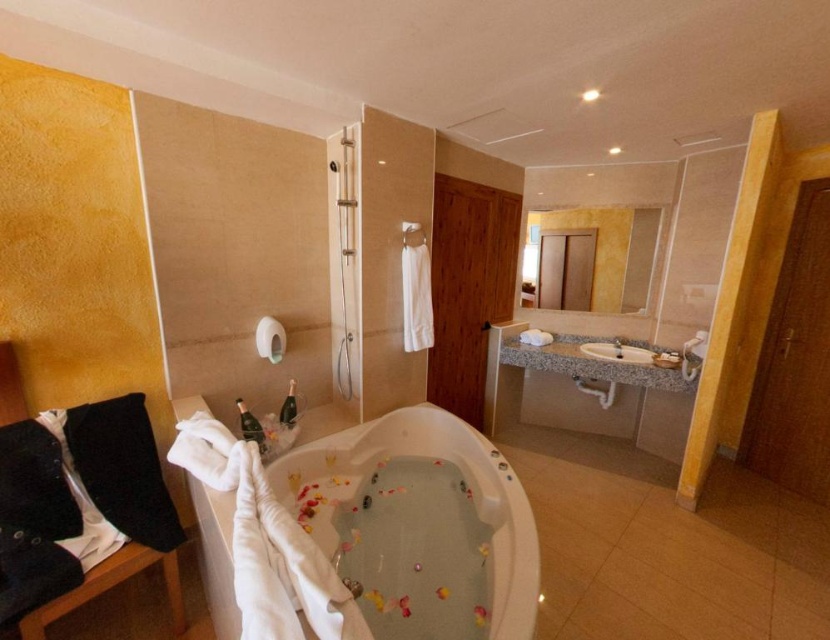
You are planning to bring a large gift box that is 1.2 meters wide into the bathroom. You want to place it next to the white glossy bathtub at center and the white marble sink at center. Which object should you place it next to if the gift box is wider than both?

The white glossy bathtub at center has a larger width than the white marble sink at center, so you should place the gift box next to the white glossy bathtub at center since it can accommodate the wider gift box.

You are designing a bathroom layout and need to ensure that the white glossy bathtub at center and the white marble sink at center are accessible to someone of average height. Based on their heights, which one would require the user to bend down more when using it?

The white marble sink at center requires the user to bend down more because it has a lower height compared to the white glossy bathtub at center.

You are standing at the entrance of the bathroom and want to fill the white glossy bathtub at center with water. Which direction should you move towards to reach the bathtub?

Since the white glossy bathtub at center is located at point 0.833 on the x and 0.439 on the y coordinates, you should move towards the center of the bathroom to reach it.